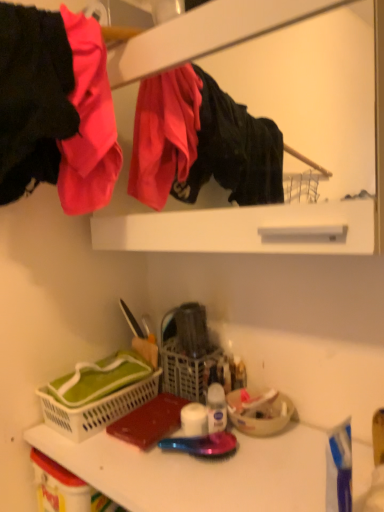
In order to click on vacant space in front of white plastic basket at lower left in this screenshot , I will do `click(125, 466)`.